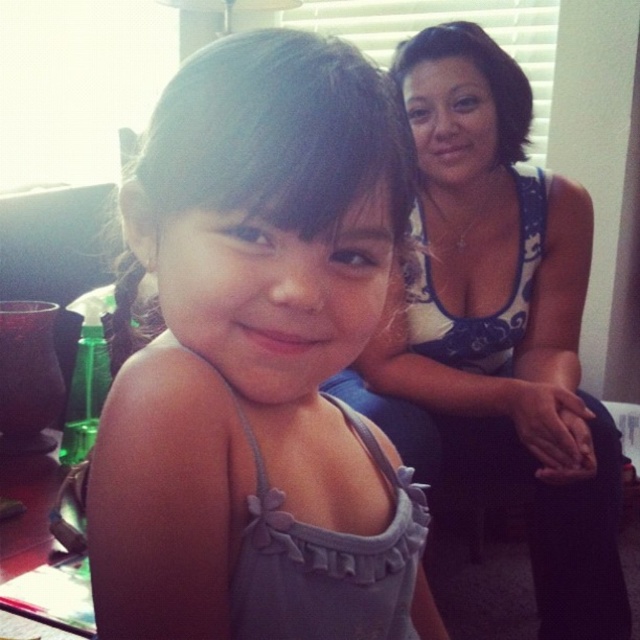
You are a photographer setting up a shoot in this room. You need to ensure that both the matte gray tank top at center and the white floral tank top at upper right are clearly visible in the photo. Based on their positions, which tank top should you focus on to make sure both are in focus?

The matte gray tank top at center is in front of the white floral tank top at upper right. To ensure both are in focus, you should focus on the matte gray tank top at center since it is closer to the camera, and the depth of field will likely include the background object as well.

You are a photographer trying to capture a candid shot of the adult woman in the background. The camera you are using has a depth of field that can focus on objects within a 10 inch range. The adult woman is wearing a matte gray tank top at center. Can you focus on her while keeping the young girl in the foreground in focus?

The adult woman in the background and the young girl in the foreground are 12.62 inches apart. Since the camera can only focus on objects within a 10 inch range, focusing on both simultaneously is not possible. You will need to choose which subject to prioritize for sharp focus.

You are taking a photo of the scene and want to ensure the focus is on the matte gray tank top at center. According to the coordinates provided, where should you adjust the focus point to? Please provide the coordinates in the format of a point like point (259, 362).

The matte gray tank top at center is located at point (259, 362), so you should adjust the focus point to point (259, 362).